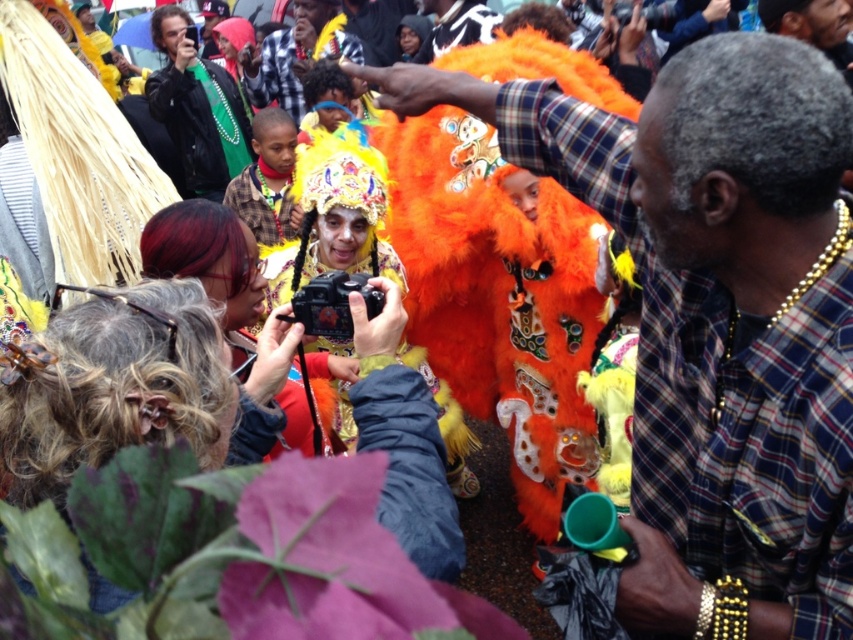
Question: Observing the image, what is the correct spatial positioning of green fabric jacket at upper left in reference to orange fuzzy costume at center?

Choices:
 (A) left
 (B) right

Answer: (A)

Question: Which of the following is the closest to the observer?

Choices:
 (A) (285, 99)
 (B) (654, 120)

Answer: (B)

Question: Can you confirm if plaid shirt at center is positioned to the right of green fabric jacket at upper left?

Choices:
 (A) yes
 (B) no

Answer: (A)

Question: Based on their relative distances, which object is nearer to the green fabric jacket at upper left?

Choices:
 (A) plaid shirt at center
 (B) orange fuzzy costume at center

Answer: (B)

Question: Which of the following is the farthest from the observer?

Choices:
 (A) (840, 538)
 (B) (228, 148)

Answer: (B)

Question: Does plaid shirt at center appear over orange fuzzy costume at center?

Choices:
 (A) yes
 (B) no

Answer: (B)